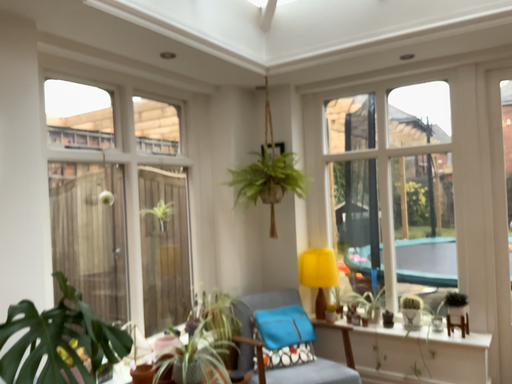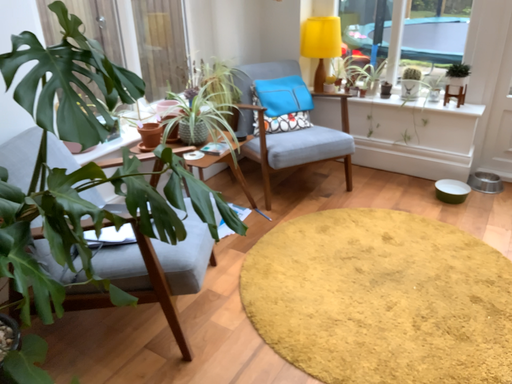
Question: How did the camera likely rotate when shooting the video?

Choices:
 (A) rotated downward
 (B) rotated upward

Answer: (A)